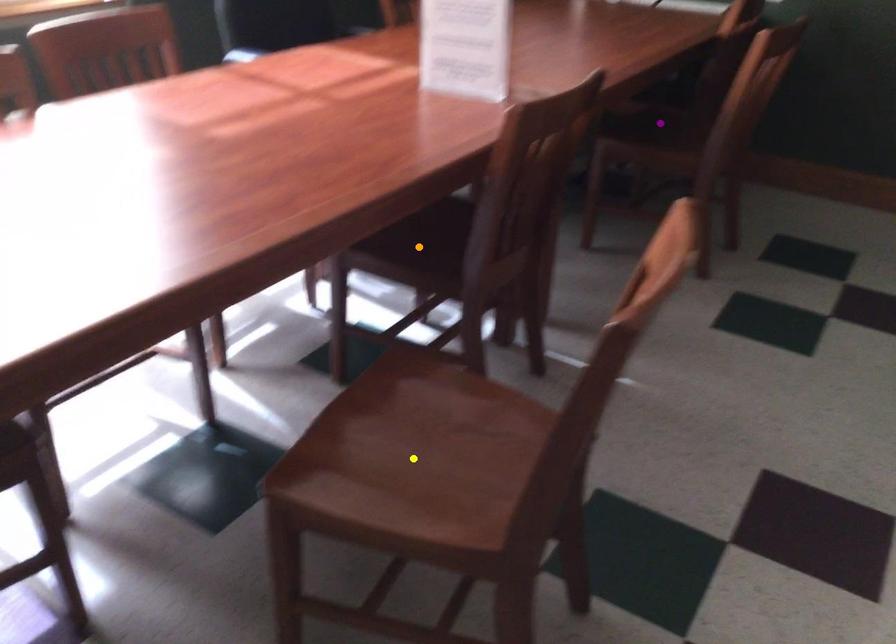
Order these from nearest to farthest:
purple point | yellow point | orange point

yellow point < orange point < purple point